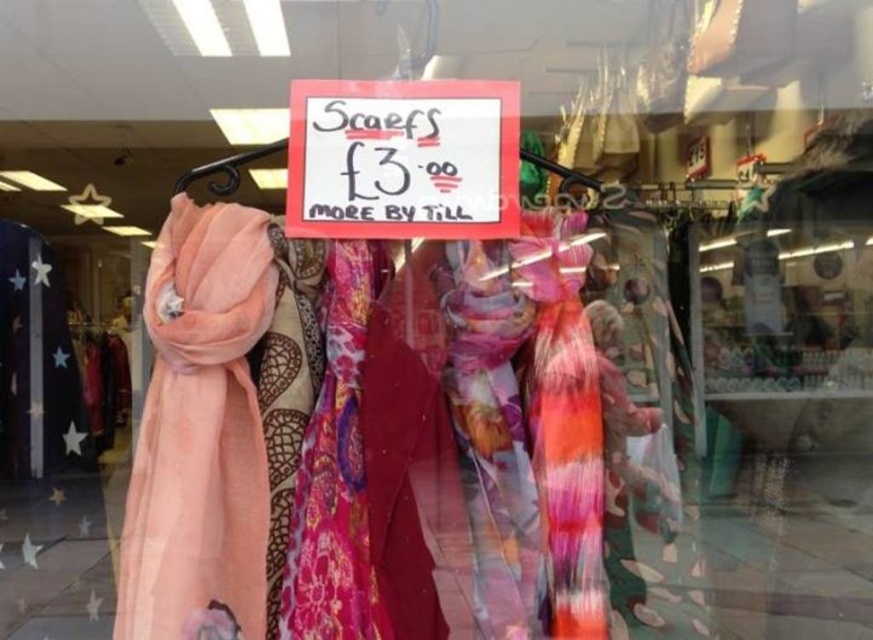
Question: Observing the image, what is the correct spatial positioning of peach silky scarf at left in reference to multicolored silky scarf at center?

Choices:
 (A) left
 (B) right

Answer: (A)

Question: Is peach silky scarf at left wider than white paper sign at center?

Choices:
 (A) yes
 (B) no

Answer: (B)

Question: Can you confirm if multicolored silky scarf at center is positioned below pink floral scarf at center?

Choices:
 (A) yes
 (B) no

Answer: (B)

Question: Which object appears closest to the camera in this image?

Choices:
 (A) multicolored silky scarf at center
 (B) peach silky scarf at left
 (C) pink floral scarf at center
 (D) white paper sign at center

Answer: (B)

Question: Estimate the real-world distances between objects in this image. Which object is closer to the multicolored silky scarf at center?

Choices:
 (A) peach silky scarf at left
 (B) pink floral scarf at center
 (C) white paper sign at center

Answer: (C)

Question: Which point is closer to the camera?

Choices:
 (A) multicolored silky scarf at center
 (B) white paper sign at center

Answer: (A)